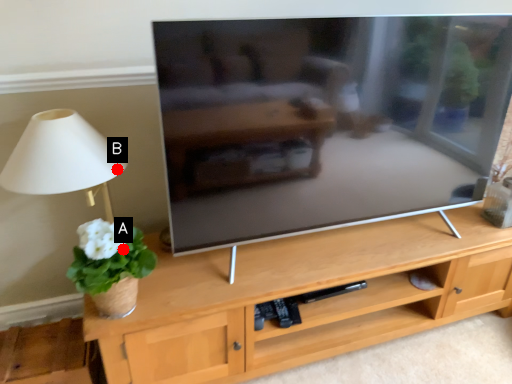
Question: Two points are circled on the image, labeled by A and B beside each circle. Which point appears closest to the camera in this image?

Choices:
 (A) A is closer
 (B) B is closer

Answer: (A)